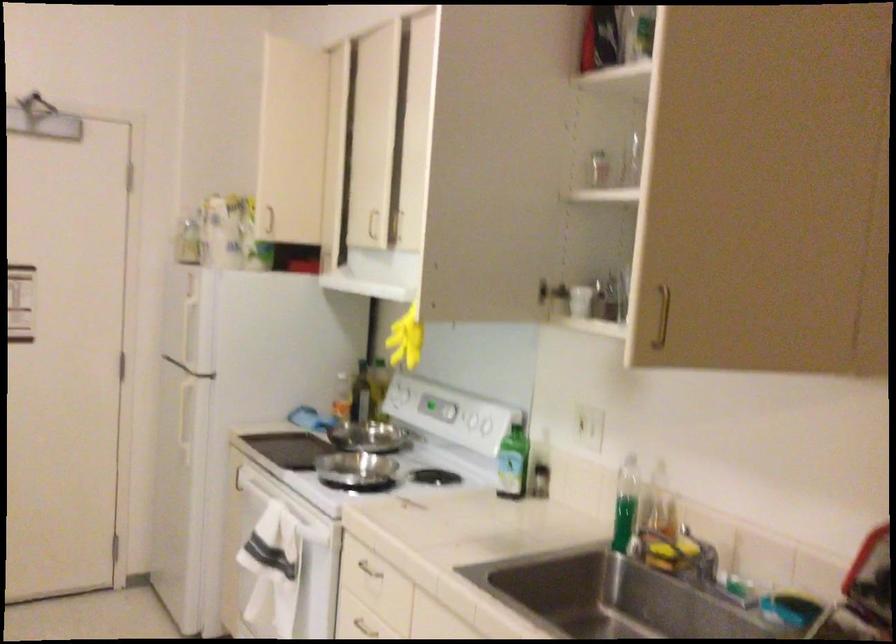
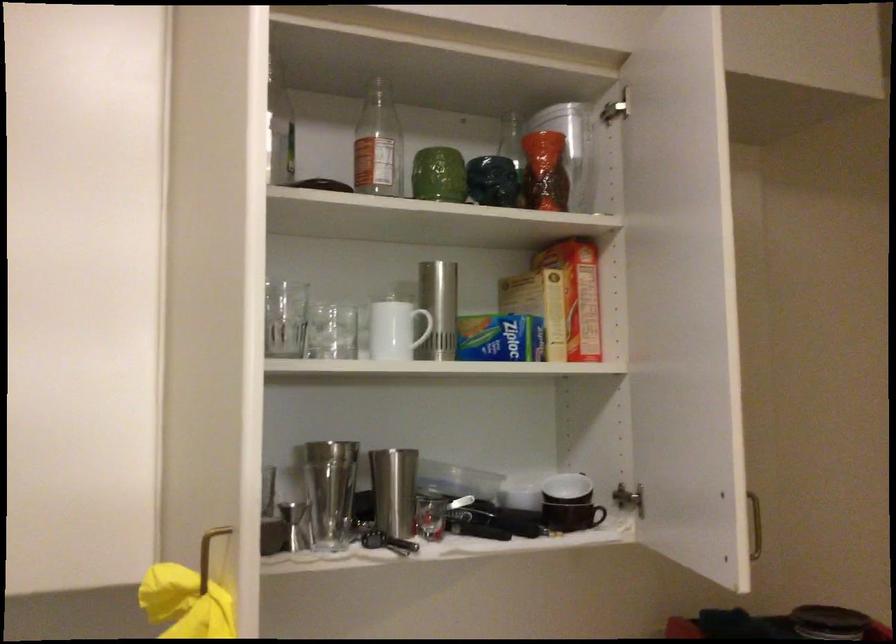
In the second image, find the point that corresponds to point 800,337 in the first image.

(570, 504)